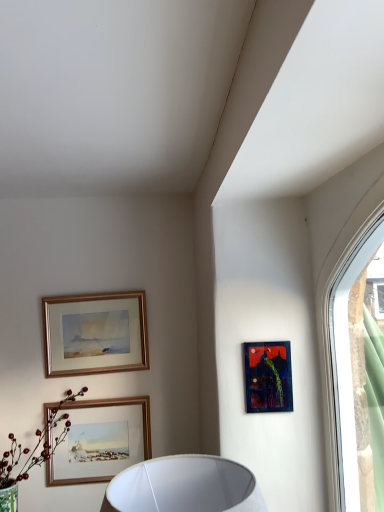
Question: Is dark blue textured painting at upper right, which is counted as the 3th picture frame, starting from the left, behind wooden framed picture at lower center, arranged as the second picture frame when viewed from the front?

Choices:
 (A) no
 (B) yes

Answer: (A)

Question: Can you confirm if dark blue textured painting at upper right, placed as the 1th picture frame when sorted from front to back, is bigger than wooden framed picture at lower center, acting as the 2th picture frame starting from the left?

Choices:
 (A) yes
 (B) no

Answer: (B)

Question: Could you tell me if dark blue textured painting at upper right, acting as the 1th picture frame starting from the right, is facing wooden framed picture at lower center, acting as the 2th picture frame starting from the left?

Choices:
 (A) no
 (B) yes

Answer: (A)

Question: Is dark blue textured painting at upper right, which is counted as the second picture frame, starting from the top, smaller than wooden framed picture at lower center, which ranks as the second picture frame in back-to-front order?

Choices:
 (A) no
 (B) yes

Answer: (B)

Question: Considering the relative positions of dark blue textured painting at upper right, which ranks as the 3th picture frame in back-to-front order, and wooden framed picture at lower center, which ranks as the second picture frame in back-to-front order, in the image provided, is dark blue textured painting at upper right, which ranks as the 3th picture frame in back-to-front order, in front of wooden framed picture at lower center, which ranks as the second picture frame in back-to-front order,?

Choices:
 (A) no
 (B) yes

Answer: (B)

Question: Would you say dark blue textured painting at upper right, which is counted as the 3th picture frame, starting from the left, contains wooden framed picture at lower center, acting as the 2th picture frame starting from the left?

Choices:
 (A) no
 (B) yes

Answer: (A)

Question: Is wooden framed picture at lower center, arranged as the second picture frame when viewed from the front, inside green matte flower at lower left?

Choices:
 (A) yes
 (B) no

Answer: (B)

Question: Does green matte flower at lower left have a lesser width compared to wooden framed picture at lower center, arranged as the second picture frame when viewed from the front?

Choices:
 (A) yes
 (B) no

Answer: (B)

Question: Considering the relative sizes of green matte flower at lower left and wooden framed picture at lower center, arranged as the second picture frame when viewed from the front, in the image provided, is green matte flower at lower left shorter than wooden framed picture at lower center, arranged as the second picture frame when viewed from the front,?

Choices:
 (A) yes
 (B) no

Answer: (B)

Question: From a real-world perspective, is green matte flower at lower left physically above wooden framed picture at lower center, arranged as the second picture frame when viewed from the front?

Choices:
 (A) no
 (B) yes

Answer: (A)

Question: Is green matte flower at lower left at the right side of wooden framed picture at lower center, acting as the 2th picture frame starting from the left?

Choices:
 (A) no
 (B) yes

Answer: (A)

Question: Is green matte flower at lower left oriented towards wooden framed picture at lower center, which ranks as the second picture frame in back-to-front order?

Choices:
 (A) yes
 (B) no

Answer: (B)

Question: From the image's perspective, does wooden-framed painting at upper left, placed as the 3th picture frame when sorted from front to back, appear higher than clear glass window at upper right?

Choices:
 (A) no
 (B) yes

Answer: (A)